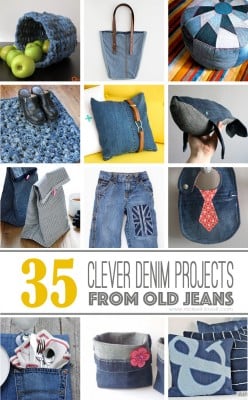
This screenshot has width=248, height=400. In order to click on stuffed toy in this screenshot , I will do `click(207, 114)`.